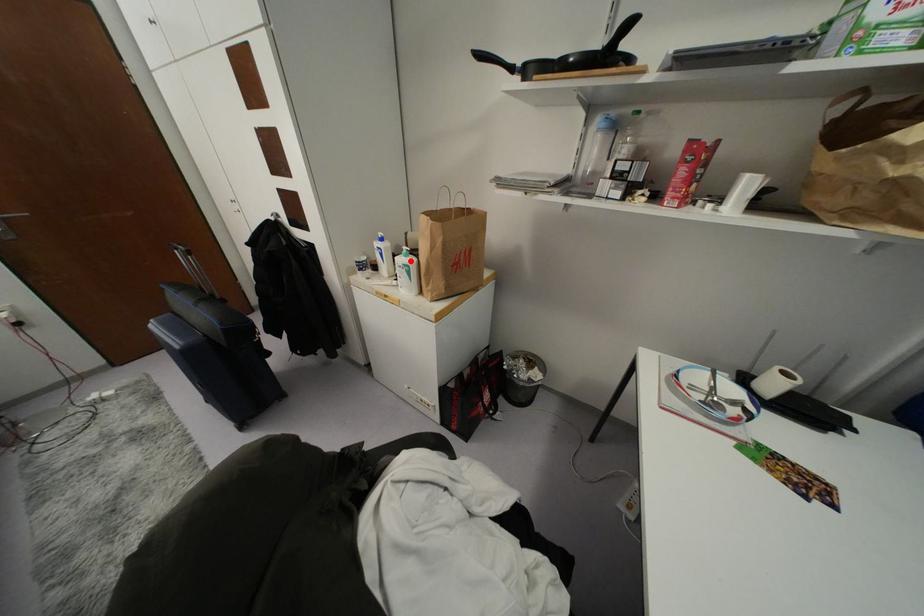
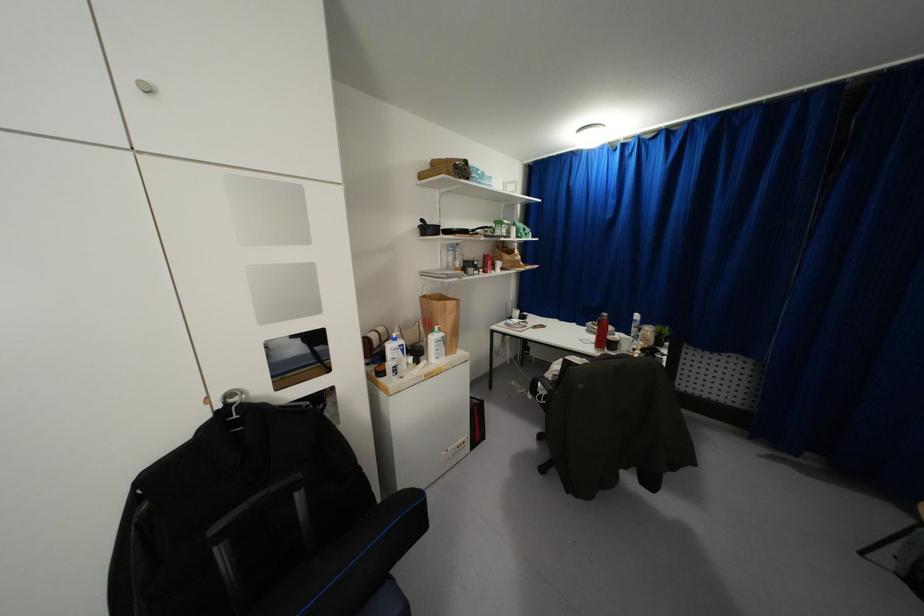
Find the pixel in the second image that matches the highlighted location in the first image.

(442, 333)